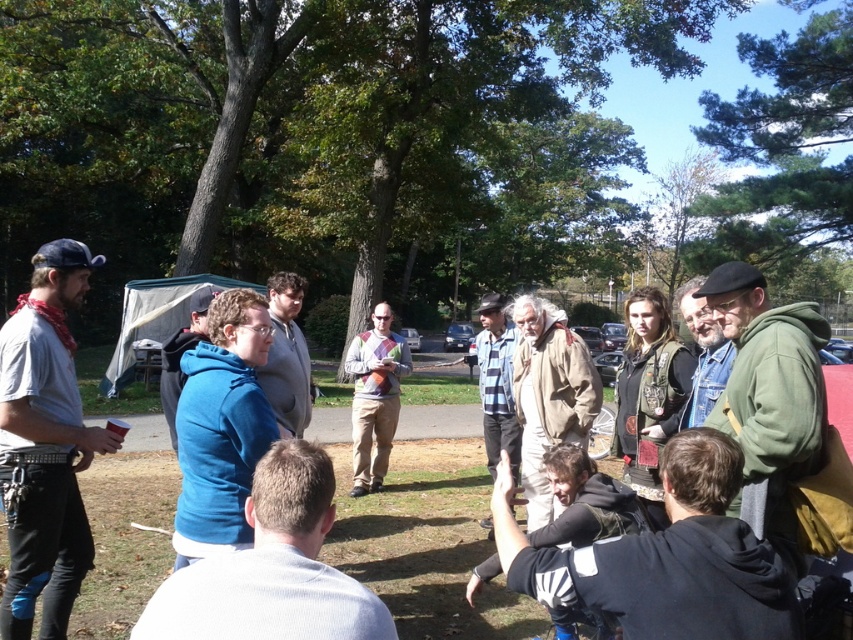
Which is more to the left, light brown suede jacket at center or striped cotton shirt at center?

striped cotton shirt at center is more to the left.

Who is more distant from viewer, (552, 433) or (482, 381)?

The point (482, 381) is more distant.

What do you see at coordinates (548, 396) in the screenshot? This screenshot has width=853, height=640. I see `light brown suede jacket at center` at bounding box center [548, 396].

Image resolution: width=853 pixels, height=640 pixels. Identify the location of light brown suede jacket at center. (548, 396).

What do you see at coordinates (666, 557) in the screenshot? I see `dark brown leather jacket at lower right` at bounding box center [666, 557].

The image size is (853, 640). I want to click on dark brown leather jacket at lower right, so click(x=666, y=557).

Between dark brown leather jacket at lower right and gray sweater at center, which one appears on the right side from the viewer's perspective?

From the viewer's perspective, dark brown leather jacket at lower right appears more on the right side.

What do you see at coordinates (666, 557) in the screenshot? I see `dark brown leather jacket at lower right` at bounding box center [666, 557].

Describe the element at coordinates (666, 557) in the screenshot. The width and height of the screenshot is (853, 640). I see `dark brown leather jacket at lower right` at that location.

The image size is (853, 640). What are the coordinates of `dark brown leather jacket at lower right` in the screenshot? It's located at (666, 557).